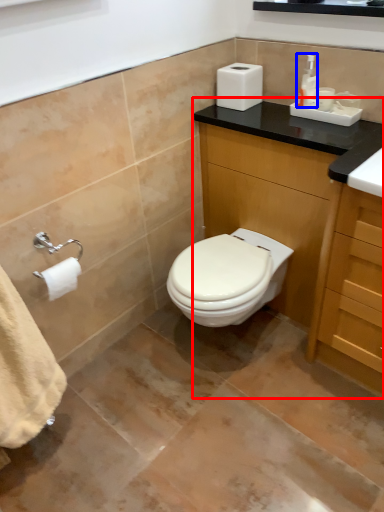
Question: Which object appears farthest to the camera in this image, bathroom cabinet (highlighted by a red box) or toiletry (highlighted by a blue box)?

Choices:
 (A) bathroom cabinet
 (B) toiletry

Answer: (B)